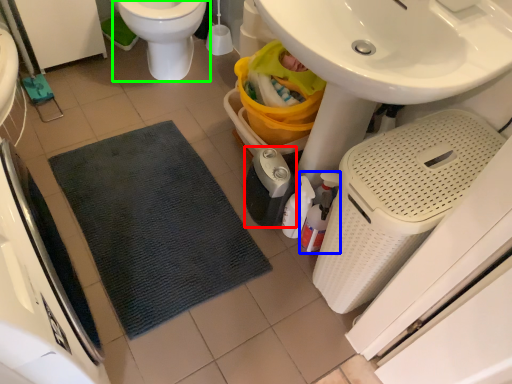
Question: Which object is the closest to the appliance (highlighted by a red box)? Choose among these: cleaning product (highlighted by a blue box) or toilet (highlighted by a green box).

Choices:
 (A) cleaning product
 (B) toilet

Answer: (A)